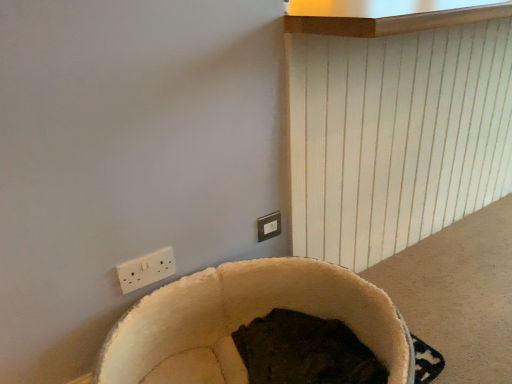
This screenshot has width=512, height=384. I want to click on white plastic power plugs and sockets at lower left, so click(x=146, y=269).

Describe the element at coordinates (245, 321) in the screenshot. The height and width of the screenshot is (384, 512). I see `beige plush bean bag chair at lower center` at that location.

The image size is (512, 384). I want to click on matte white switch at upper center, so click(269, 226).

Is beige plush bean bag chair at lower center in contact with matte white switch at upper center?

No, beige plush bean bag chair at lower center is not beside matte white switch at upper center.

Can you confirm if beige plush bean bag chair at lower center is smaller than matte white switch at upper center?

Incorrect, beige plush bean bag chair at lower center is not smaller in size than matte white switch at upper center.

Is beige plush bean bag chair at lower center shorter than matte white switch at upper center?

Yes.

From a real-world perspective, does beige plush bean bag chair at lower center stand above matte white switch at upper center?

No, from a real-world perspective, beige plush bean bag chair at lower center is not above matte white switch at upper center.

Could you tell me if white plastic power plugs and sockets at lower left is turned towards beige plush bean bag chair at lower center?

No, white plastic power plugs and sockets at lower left does not turn towards beige plush bean bag chair at lower center.

Consider the image. Does white plastic power plugs and sockets at lower left appear on the left side of beige plush bean bag chair at lower center?

Yes.

Which of these two, white plastic power plugs and sockets at lower left or beige plush bean bag chair at lower center, stands taller?

white plastic power plugs and sockets at lower left.

How many degrees apart are the facing directions of white plastic power plugs and sockets at lower left and beige plush bean bag chair at lower center?

The angular difference between white plastic power plugs and sockets at lower left and beige plush bean bag chair at lower center is 179 degrees.

Is beige plush bean bag chair at lower center turned away from white plastic power plugs and sockets at lower left?

No, white plastic power plugs and sockets at lower left is not at the back of beige plush bean bag chair at lower center.

Is beige plush bean bag chair at lower center situated inside white plastic power plugs and sockets at lower left or outside?

beige plush bean bag chair at lower center is located beyond the bounds of white plastic power plugs and sockets at lower left.

Is beige plush bean bag chair at lower center to the left or to the right of white plastic power plugs and sockets at lower left in the image?

beige plush bean bag chair at lower center is to the right of white plastic power plugs and sockets at lower left.

From the image's perspective, does beige plush bean bag chair at lower center appear lower than white plastic power plugs and sockets at lower left?

Yes, from the image's perspective, beige plush bean bag chair at lower center is beneath white plastic power plugs and sockets at lower left.

Does point (279, 221) come closer to viewer compared to point (161, 254)?

That is False.

From a real-world perspective, is matte white switch at upper center located higher than white plastic power plugs and sockets at lower left?

Actually, matte white switch at upper center is physically below white plastic power plugs and sockets at lower left in the real world.

Can you confirm if matte white switch at upper center is wider than white plastic power plugs and sockets at lower left?

No, matte white switch at upper center is not wider than white plastic power plugs and sockets at lower left.

Who is more distant, matte white switch at upper center or white plastic power plugs and sockets at lower left?

matte white switch at upper center is further away from the camera.

Are matte white switch at upper center and beige plush bean bag chair at lower center located far from each other?

No, matte white switch at upper center is in close proximity to beige plush bean bag chair at lower center.

From the image's perspective, is matte white switch at upper center located above or below beige plush bean bag chair at lower center?

matte white switch at upper center is situated higher than beige plush bean bag chair at lower center in the image.

Which of these two, matte white switch at upper center or beige plush bean bag chair at lower center, stands taller?

matte white switch at upper center.

Which point is more distant from viewer, (262, 221) or (99, 382)?

The point (262, 221) is behind.

Is white plastic power plugs and sockets at lower left facing towards matte white switch at upper center?

No, white plastic power plugs and sockets at lower left is not oriented towards matte white switch at upper center.

Does point (133, 271) appear closer or farther from the camera than point (278, 223)?

Clearly, point (133, 271) is closer to the camera than point (278, 223).

From a real-world perspective, is white plastic power plugs and sockets at lower left under matte white switch at upper center?

Incorrect, from a real-world perspective, white plastic power plugs and sockets at lower left is higher than matte white switch at upper center.

Locate an element on the screen. The image size is (512, 384). electric outlet located behind the beige plush bean bag chair at lower center is located at coordinates (269, 226).

Where is `power plugs and sockets to the left of beige plush bean bag chair at lower center`? The image size is (512, 384). power plugs and sockets to the left of beige plush bean bag chair at lower center is located at coordinates (146, 269).

Estimate the real-world distances between objects in this image. Which object is further from beige plush bean bag chair at lower center, white plastic power plugs and sockets at lower left or matte white switch at upper center?

matte white switch at upper center.

When comparing their distances from beige plush bean bag chair at lower center, does matte white switch at upper center or white plastic power plugs and sockets at lower left seem further?

matte white switch at upper center is positioned further to the anchor beige plush bean bag chair at lower center.

Which object lies nearer to the anchor point white plastic power plugs and sockets at lower left, matte white switch at upper center or beige plush bean bag chair at lower center?

Based on the image, beige plush bean bag chair at lower center appears to be nearer to white plastic power plugs and sockets at lower left.

Considering their positions, is white plastic power plugs and sockets at lower left positioned further to matte white switch at upper center than beige plush bean bag chair at lower center?

Based on the image, white plastic power plugs and sockets at lower left appears to be further to matte white switch at upper center.

Looking at the image, which one is located closer to white plastic power plugs and sockets at lower left, beige plush bean bag chair at lower center or matte white switch at upper center?

beige plush bean bag chair at lower center is closer to white plastic power plugs and sockets at lower left.

Based on their spatial positions, is beige plush bean bag chair at lower center or white plastic power plugs and sockets at lower left closer to matte white switch at upper center?

The object closer to matte white switch at upper center is beige plush bean bag chair at lower center.

Find the location of a particular element. The height and width of the screenshot is (384, 512). electric outlet between white plastic power plugs and sockets at lower left and beige plush bean bag chair at lower center from left to right is located at coordinates (269, 226).